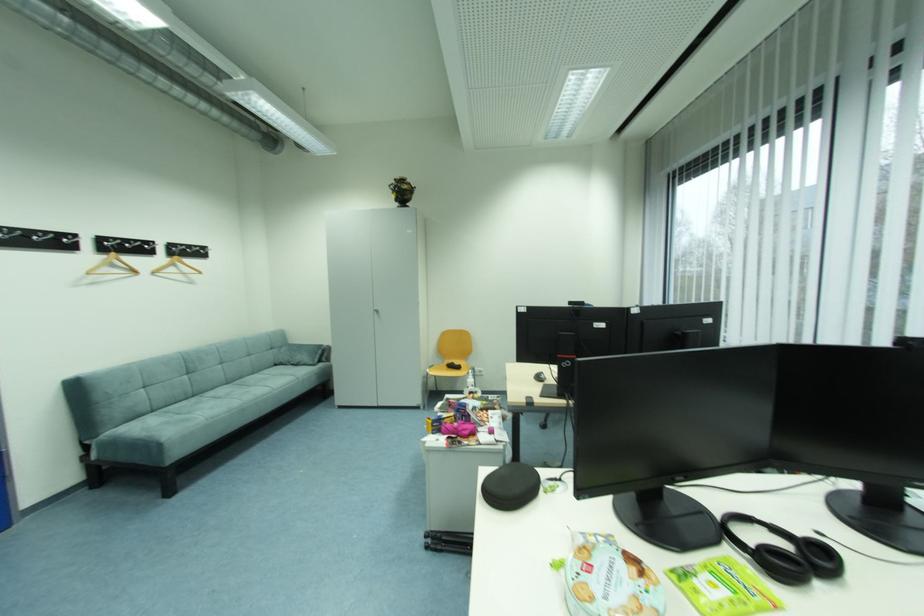
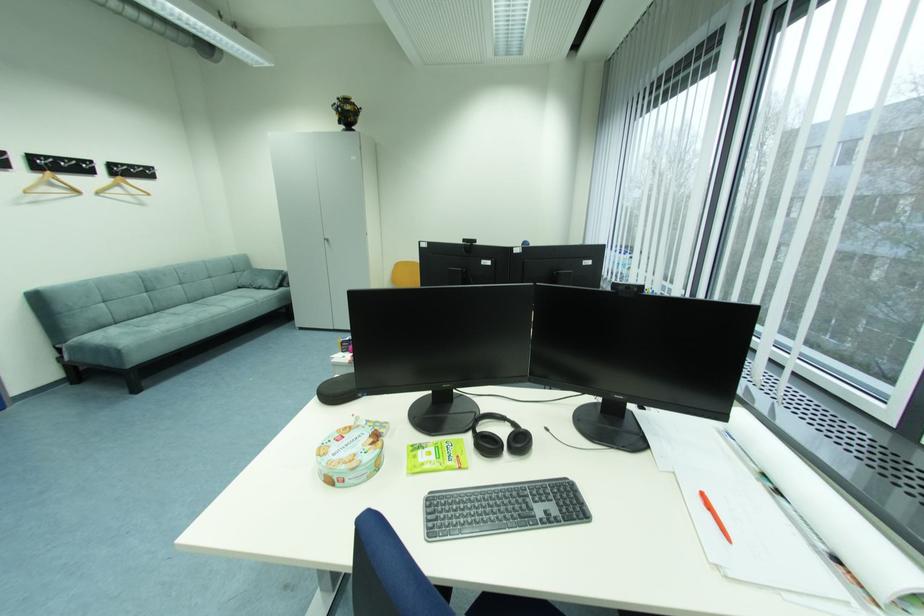
Question: How did the camera likely rotate?

Choices:
 (A) Left
 (B) Right
 (C) Up
 (D) Down

Answer: (D)